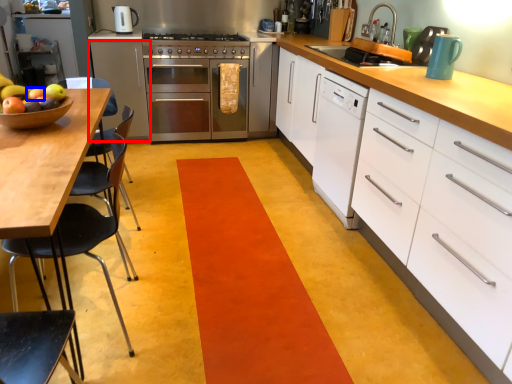
Question: Among these objects, which one is nearest to the camera, cabinetry (highlighted by a red box) or apple (highlighted by a blue box)?

Choices:
 (A) cabinetry
 (B) apple

Answer: (B)